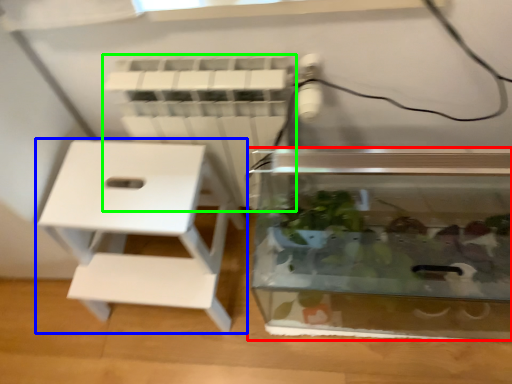
Question: Considering the real-world distances, which object is closest to glass box (highlighted by a red box)? furniture (highlighted by a blue box) or radiator (highlighted by a green box).

Choices:
 (A) furniture
 (B) radiator

Answer: (B)